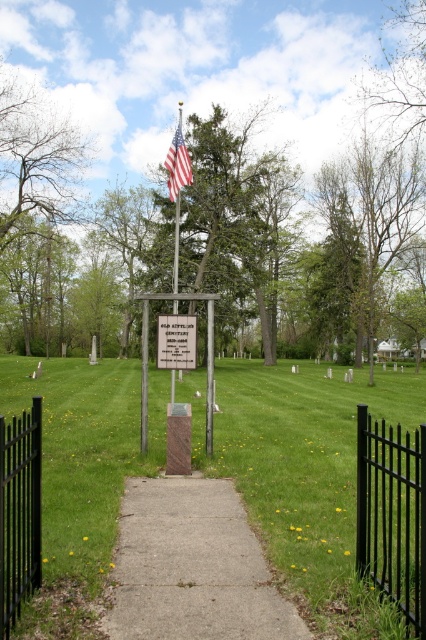
Who is positioned more to the left, green leafy tree at center or black metal fence at left?

black metal fence at left

Between point (206, 160) and point (3, 429), which one is positioned behind?

Positioned behind is point (206, 160).

Locate an element on the screen. green leafy tree at center is located at coordinates (236, 216).

Which is more to the right, green grass at center or green leafy tree at center?

From the viewer's perspective, green leafy tree at center appears more on the right side.

Who is positioned more to the left, green grass at center or green leafy tree at center?

green grass at center is more to the left.

Which is in front, point (281, 486) or point (252, 184)?

Point (281, 486) is in front.

This screenshot has width=426, height=640. Find the location of `green grass at center`. green grass at center is located at coordinates (305, 476).

Measure the distance between green grass at center and camera.

green grass at center and camera are 3.36 meters apart.

Is green grass at center shorter than black metal fence at right?

Incorrect, green grass at center's height does not fall short of black metal fence at right's.

Image resolution: width=426 pixels, height=640 pixels. What are the coordinates of `green grass at center` in the screenshot? It's located at (305, 476).